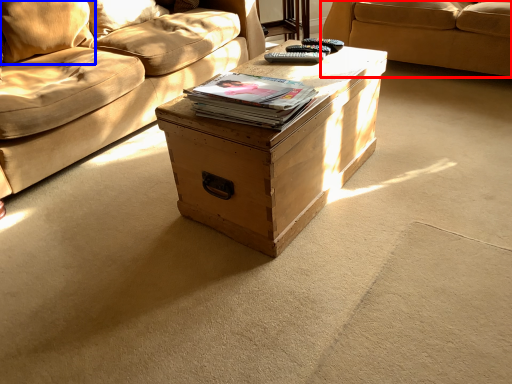
Question: Which point is further to the camera, studio couch (highlighted by a red box) or pillow (highlighted by a blue box)?

Choices:
 (A) studio couch
 (B) pillow

Answer: (A)